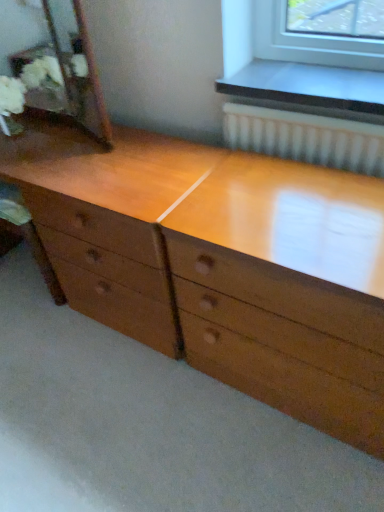
Where is `vacant space underneath wooden mirror at left (from a real-world perspective)`? vacant space underneath wooden mirror at left (from a real-world perspective) is located at coordinates (64, 133).